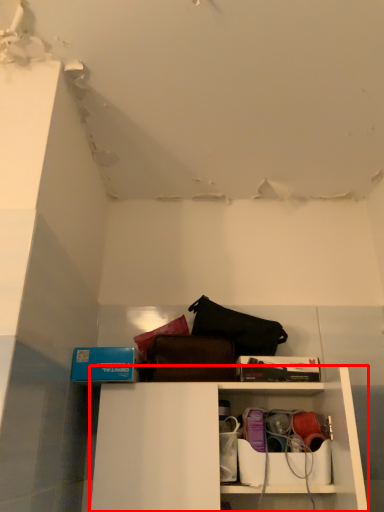
Question: Where is shelf (annotated by the red box) located in relation to cabinet in the image?

Choices:
 (A) left
 (B) right

Answer: (A)